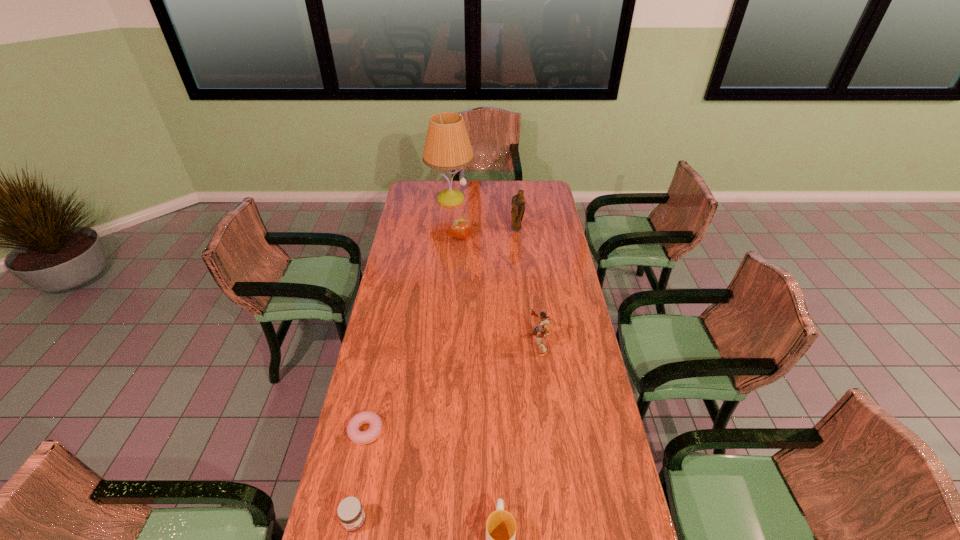
This screenshot has width=960, height=540. Find the location of `the farthest object`. the farthest object is located at coordinates (447, 147).

At what (x,y) coordinates should I click in order to perform the action: click on the tallest object. Please return your answer as a coordinate pair (x, y). Looking at the image, I should click on (447, 147).

The width and height of the screenshot is (960, 540). Identify the location of the sixth shortest object. (518, 202).

You are a GUI agent. You are given a task and a screenshot of the screen. Output one action in this format:
    pyautogui.click(x=<x>, y=<y>)
    Task: Click on the puncher
    This screenshot has height=540, width=960.
    Given the screenshot: What is the action you would take?
    pyautogui.click(x=542, y=330)

Locate an element on the screen. The height and width of the screenshot is (540, 960). the fourth farthest object is located at coordinates (542, 330).

Identify the location of apple. (460, 228).

You are a GUI agent. You are given a task and a screenshot of the screen. Output one action in this format:
    pyautogui.click(x=<x>, y=<y>)
    Task: Click on the jam
    
    Given the screenshot: What is the action you would take?
    pyautogui.click(x=351, y=514)

You are a GUI agent. You are given a task and a screenshot of the screen. Output one action in this format:
    pyautogui.click(x=<x>, y=<y>)
    Task: Click on the fifth farthest object
    The width and height of the screenshot is (960, 540).
    Given the screenshot: What is the action you would take?
    pyautogui.click(x=355, y=435)

Find the location of a particular element. the shortest object is located at coordinates (355, 435).

The width and height of the screenshot is (960, 540). Identify the location of free location located 0.110m on the side of the tallest object near the pull switch. (448, 223).